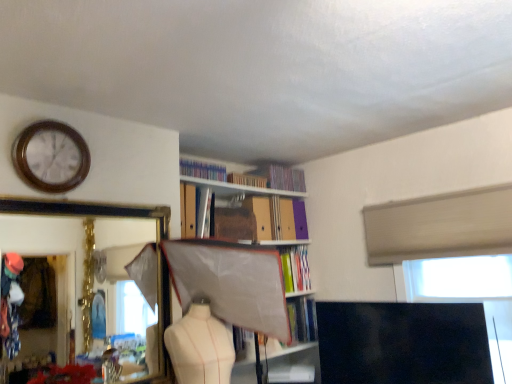
The width and height of the screenshot is (512, 384). What are the coordinates of `matte plastic book at upper center, acting as the 6th book starting from the bottom` in the screenshot? It's located at (247, 180).

This screenshot has height=384, width=512. What do you see at coordinates (271, 234) in the screenshot?
I see `matte cardboard bookcase at center` at bounding box center [271, 234].

What is the approximate height of hardcover book at upper center, the 3th book positioned from the bottom?

The height of hardcover book at upper center, the 3th book positioned from the bottom, is 33.28 centimeters.

This screenshot has height=384, width=512. What do you see at coordinates (190, 210) in the screenshot?
I see `matte cardboard book at upper center, the fifth book in the bottom-to-top sequence` at bounding box center [190, 210].

Identify the location of matte plastic book at upper center, acting as the third book starting from the top. tap(247, 180).

Does hardcover books at upper center, the 8th book positioned from the bottom, have a lesser width compared to hardcover book at center, the first book ordered from the bottom?

Yes, hardcover books at upper center, the 8th book positioned from the bottom, is thinner than hardcover book at center, the first book ordered from the bottom.

What's the angular difference between hardcover books at upper center, marked as the first book in a top-to-bottom arrangement, and hardcover book at center, the first book ordered from the bottom,'s facing directions?

The facing directions of hardcover books at upper center, marked as the first book in a top-to-bottom arrangement, and hardcover book at center, the first book ordered from the bottom, are 49.7 degrees apart.

From a real-world perspective, relative to hardcover book at center, which ranks as the 8th book in top-to-bottom order, is hardcover books at upper center, marked as the first book in a top-to-bottom arrangement, vertically above or below?

hardcover books at upper center, marked as the first book in a top-to-bottom arrangement, is situated higher than hardcover book at center, which ranks as the 8th book in top-to-bottom order, in the real world.

Is hardcover books at upper center, marked as the first book in a top-to-bottom arrangement, taller than hardcover book at center, which ranks as the 8th book in top-to-bottom order?

Indeed, hardcover books at upper center, marked as the first book in a top-to-bottom arrangement, has a greater height compared to hardcover book at center, which ranks as the 8th book in top-to-bottom order.

Which object is thinner, hardcover book at upper center, which is counted as the sixth book, starting from the top, or hardcover book at center, the 2th book ordered from the bottom?

With smaller width is hardcover book at center, the 2th book ordered from the bottom.

I want to click on book that is the 1st one below the hardcover book at upper center, which is counted as the sixth book, starting from the top (from a real-world perspective), so click(302, 319).

Is hardcover book at upper center, the 3th book positioned from the bottom, facing away from hardcover book at center, the 7th book from the top?

No, hardcover book at upper center, the 3th book positioned from the bottom,'s orientation is not away from hardcover book at center, the 7th book from the top.

Is point (283, 268) closer to viewer compared to point (292, 334)?

No, it is behind (292, 334).

From the image's perspective, between hardcover books at upper center, the 2th book positioned from the top, and metallic silver book at upper center, acting as the 5th book starting from the top, which one is located above?

hardcover books at upper center, the 2th book positioned from the top.

Is hardcover books at upper center, the 2th book positioned from the top, surrounding metallic silver book at upper center, which appears as the fourth book when ordered from the bottom?

No, metallic silver book at upper center, which appears as the fourth book when ordered from the bottom, is not a part of hardcover books at upper center, the 2th book positioned from the top.

How distant is hardcover books at upper center, the 2th book positioned from the top, from metallic silver book at upper center, which appears as the fourth book when ordered from the bottom?

hardcover books at upper center, the 2th book positioned from the top, and metallic silver book at upper center, which appears as the fourth book when ordered from the bottom, are 26.11 inches apart from each other.

What are the coordinates of `the 4th book located beneath the hardcover books at upper center, the 2th book positioned from the top (from a real-world perspective)` in the screenshot? It's located at (204, 212).

Can you confirm if matte cardboard book at upper center, the fifth book in the bottom-to-top sequence, is bigger than matte cardboard bookcase at center?

Actually, matte cardboard book at upper center, the fifth book in the bottom-to-top sequence, might be smaller than matte cardboard bookcase at center.

From the image's perspective, relative to matte cardboard bookcase at center, is matte cardboard book at upper center, positioned as the 4th book in top-to-bottom order, above or below?

Clearly, from the image's perspective, matte cardboard book at upper center, positioned as the 4th book in top-to-bottom order, is above matte cardboard bookcase at center.

Could you tell me if matte cardboard book at upper center, positioned as the 4th book in top-to-bottom order, is facing matte cardboard bookcase at center?

No, matte cardboard book at upper center, positioned as the 4th book in top-to-bottom order, is not aimed at matte cardboard bookcase at center.

Is hardcover book at center, which ranks as the 8th book in top-to-bottom order, positioned with its back to hardcover books at upper center, marked as the first book in a top-to-bottom arrangement?

That's not correct — hardcover book at center, which ranks as the 8th book in top-to-bottom order, is not looking away from hardcover books at upper center, marked as the first book in a top-to-bottom arrangement.

In terms of height, does hardcover book at center, the first book ordered from the bottom, look taller or shorter compared to hardcover books at upper center, the 8th book positioned from the bottom?

Considering their sizes, hardcover book at center, the first book ordered from the bottom, has less height than hardcover books at upper center, the 8th book positioned from the bottom.

Are hardcover book at center, the first book ordered from the bottom, and hardcover books at upper center, marked as the first book in a top-to-bottom arrangement, beside each other?

No, hardcover book at center, the first book ordered from the bottom, is not with hardcover books at upper center, marked as the first book in a top-to-bottom arrangement.

Is hardcover book at center, the first book ordered from the bottom, surrounding hardcover books at upper center, the 8th book positioned from the bottom?

No.

From a real-world perspective, who is located higher, hardcover books at upper center, marked as the first book in a top-to-bottom arrangement, or hardcover books at upper center, acting as the seventh book starting from the bottom?

hardcover books at upper center, acting as the seventh book starting from the bottom, from a real-world perspective.

Would you say hardcover books at upper center, the 8th book positioned from the bottom, is to the left or to the right of hardcover books at upper center, acting as the seventh book starting from the bottom, in the picture?

From the image, it's evident that hardcover books at upper center, the 8th book positioned from the bottom, is to the left of hardcover books at upper center, acting as the seventh book starting from the bottom.

Which of these two, hardcover books at upper center, marked as the first book in a top-to-bottom arrangement, or hardcover books at upper center, the 2th book positioned from the top, is bigger?

hardcover books at upper center, the 2th book positioned from the top, is bigger.

Is the position of hardcover books at upper center, marked as the first book in a top-to-bottom arrangement, less distant than that of hardcover books at upper center, the 2th book positioned from the top?

That is True.

Where is `bookcase below the hardcover books at upper center, the 2th book positioned from the top (from a real-world perspective)`? bookcase below the hardcover books at upper center, the 2th book positioned from the top (from a real-world perspective) is located at coordinates (271, 234).

Which is behind, hardcover books at upper center, acting as the seventh book starting from the bottom, or matte cardboard bookcase at center?

hardcover books at upper center, acting as the seventh book starting from the bottom, is further from the camera.

How many degrees apart are the facing directions of hardcover books at upper center, the 2th book positioned from the top, and matte cardboard bookcase at center?

There is a 3.94-degree angle between the facing directions of hardcover books at upper center, the 2th book positioned from the top, and matte cardboard bookcase at center.

In the image, is hardcover books at upper center, the 2th book positioned from the top, on the left side or the right side of matte cardboard bookcase at center?

From the image, it's evident that hardcover books at upper center, the 2th book positioned from the top, is to the right of matte cardboard bookcase at center.

From a real-world perspective, starting from the hardcover book at center, the first book ordered from the bottom, which book is the 6th one vertically above it? Please provide its 2D coordinates.

[(202, 170)]

Find the location of a particular element. the 1st book counting from the right of the hardcover book at center, the 2th book ordered from the bottom is located at coordinates (295, 268).

Based on their spatial positions, is hardcover book at center, the first book ordered from the bottom, or hardcover books at upper center, acting as the seventh book starting from the bottom, further from metallic silver book at upper center, acting as the 5th book starting from the top?

hardcover book at center, the first book ordered from the bottom, is further to metallic silver book at upper center, acting as the 5th book starting from the top.

Looking at the image, which one is located further to woodenclock at upper left, metallic silver book at upper center, which appears as the fourth book when ordered from the bottom, or matte cardboard book at upper center, positioned as the 4th book in top-to-bottom order?

metallic silver book at upper center, which appears as the fourth book when ordered from the bottom, lies further to woodenclock at upper left than the other object.

Looking at the image, which one is located further to hardcover book at center, which ranks as the 8th book in top-to-bottom order, hardcover book at upper center, which is counted as the sixth book, starting from the top, or hardcover book at center, the 7th book from the top?

hardcover book at upper center, which is counted as the sixth book, starting from the top, is further to hardcover book at center, which ranks as the 8th book in top-to-bottom order.

Considering their positions, is hardcover book at center, the first book ordered from the bottom, positioned closer to hardcover book at center, the 7th book from the top, than hardcover books at upper center, marked as the first book in a top-to-bottom arrangement?

hardcover book at center, the first book ordered from the bottom, lies closer to hardcover book at center, the 7th book from the top, than the other object.

Looking at the image, which one is located further to matte cardboard book at upper center, positioned as the 4th book in top-to-bottom order, woodenclock at upper left or matte plastic book at upper center, acting as the third book starting from the top?

The object further to matte cardboard book at upper center, positioned as the 4th book in top-to-bottom order, is woodenclock at upper left.

From the image, which object appears to be farther from metallic silver book at upper center, which appears as the fourth book when ordered from the bottom, hardcover books at upper center, acting as the seventh book starting from the bottom, or gold-framed mirror at upper left?

gold-framed mirror at upper left is positioned further to the anchor metallic silver book at upper center, which appears as the fourth book when ordered from the bottom.

Based on their spatial positions, is hardcover books at upper center, the 2th book positioned from the top, or metallic silver book at upper center, acting as the 5th book starting from the top, closer to matte plastic book at upper center, acting as the third book starting from the top?

hardcover books at upper center, the 2th book positioned from the top.

Looking at the image, which one is located closer to hardcover book at upper center, which is counted as the sixth book, starting from the top, hardcover book at center, the first book ordered from the bottom, or gold-framed mirror at upper left?

hardcover book at center, the first book ordered from the bottom, is positioned closer to the anchor hardcover book at upper center, which is counted as the sixth book, starting from the top.

You are a GUI agent. You are given a task and a screenshot of the screen. Output one action in this format:
    pyautogui.click(x=<x>, y=<y>)
    Task: Click on the bookcase that lies between matte plastic book at upper center, acting as the third book starting from the top, and hardcover book at center, the first book ordered from the bottom, from top to bottom
    The width and height of the screenshot is (512, 384).
    Given the screenshot: What is the action you would take?
    pyautogui.click(x=271, y=234)

At what (x,y) coordinates should I click in order to perform the action: click on bookcase situated between gold-framed mirror at upper left and white plastic window screen at upper right from left to right. Please return your answer as a coordinate pair (x, y). This screenshot has height=384, width=512. Looking at the image, I should click on [271, 234].

At what (x,y) coordinates should I click in order to perform the action: click on book between matte cardboard bookcase at center and hardcover books at upper center, marked as the first book in a top-to-bottom arrangement, along the z-axis. Please return your answer as a coordinate pair (x, y). Looking at the image, I should click on (190, 210).

Where is `bookcase between gold-framed mirror at upper left and hardcover books at upper center, marked as the first book in a top-to-bottom arrangement, in the front-back direction`? Image resolution: width=512 pixels, height=384 pixels. bookcase between gold-framed mirror at upper left and hardcover books at upper center, marked as the first book in a top-to-bottom arrangement, in the front-back direction is located at coordinates (271, 234).